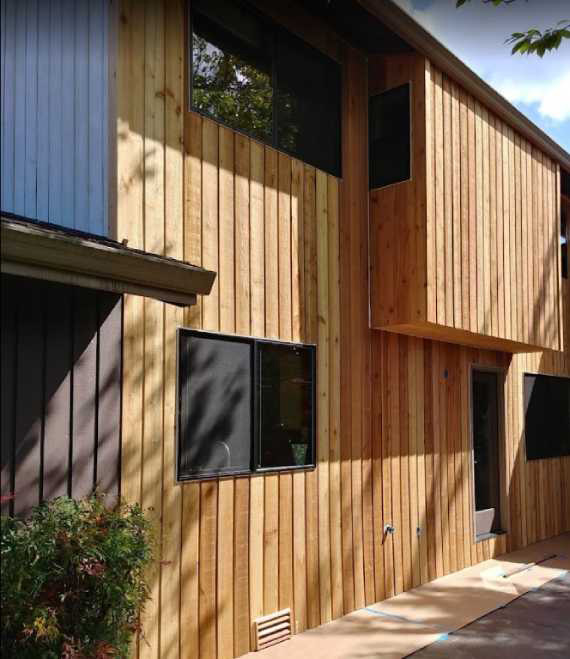
Locate an element on the screen. window is located at coordinates (272, 424).